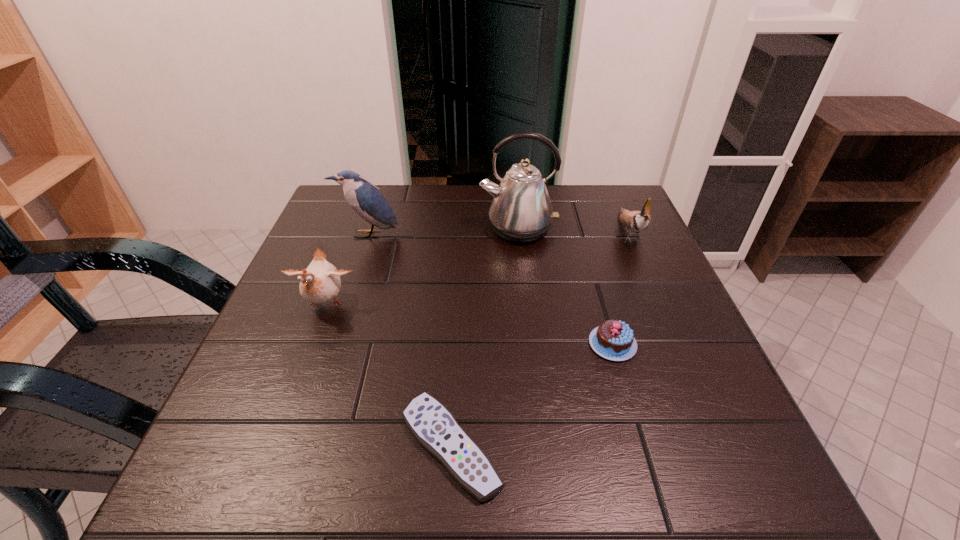
I want to click on vacant space located at the face of the rightmost bird, so click(656, 293).

Locate an element on the screen. vacant space situated 0.200m at the beak of the nearest bird is located at coordinates (284, 414).

Where is `free space located 0.230m on the left of the second nearest object`? free space located 0.230m on the left of the second nearest object is located at coordinates (468, 344).

The width and height of the screenshot is (960, 540). In order to click on free space located on the right of the nearest object in this screenshot , I will do `click(734, 446)`.

The image size is (960, 540). Identify the location of kettle situated at the far edge. 521,211.

Image resolution: width=960 pixels, height=540 pixels. Find the location of `object that is positioned at the near edge`. object that is positioned at the near edge is located at coordinates (435, 428).

Locate an element on the screen. The height and width of the screenshot is (540, 960). bird that is at the right edge is located at coordinates (636, 221).

I want to click on chocolate cake that is at the right edge, so click(614, 340).

Identify the location of object at the far left corner. click(x=366, y=200).

In order to click on object present at the far right corner in this screenshot , I will do `click(636, 221)`.